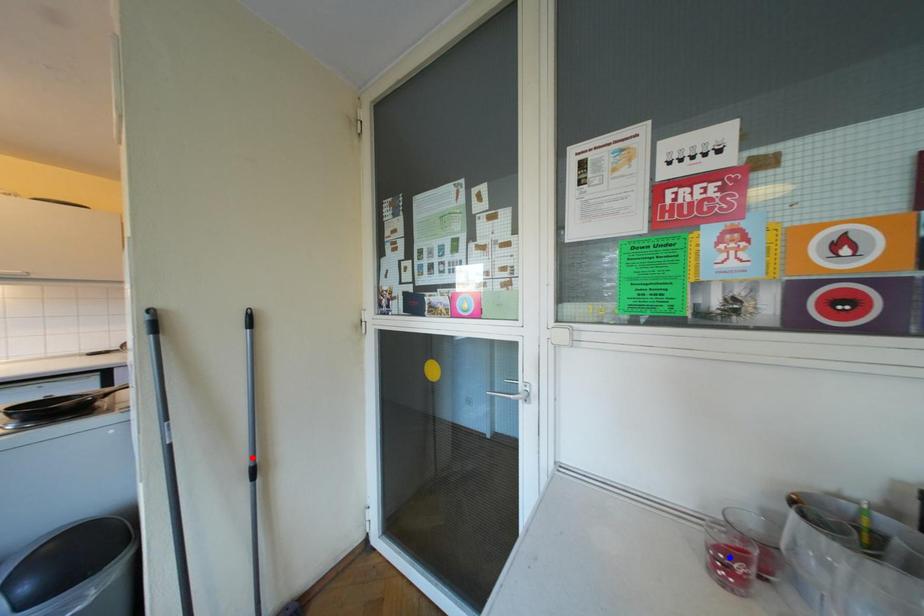
Question: Which of the two points in the image is closer to the camera?

Choices:
 (A) Blue point is closer.
 (B) Red point is closer.

Answer: (A)